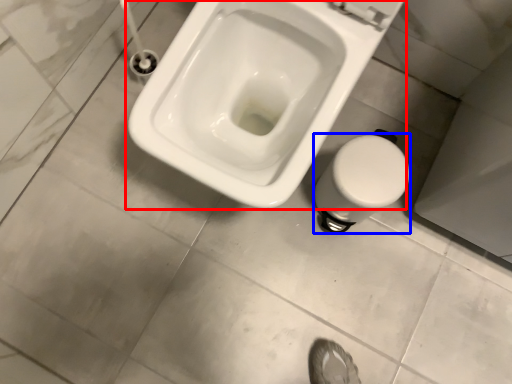
Question: Among these objects, which one is farthest to the camera, toilet (highlighted by a red box) or bidet (highlighted by a blue box)?

Choices:
 (A) toilet
 (B) bidet

Answer: (B)